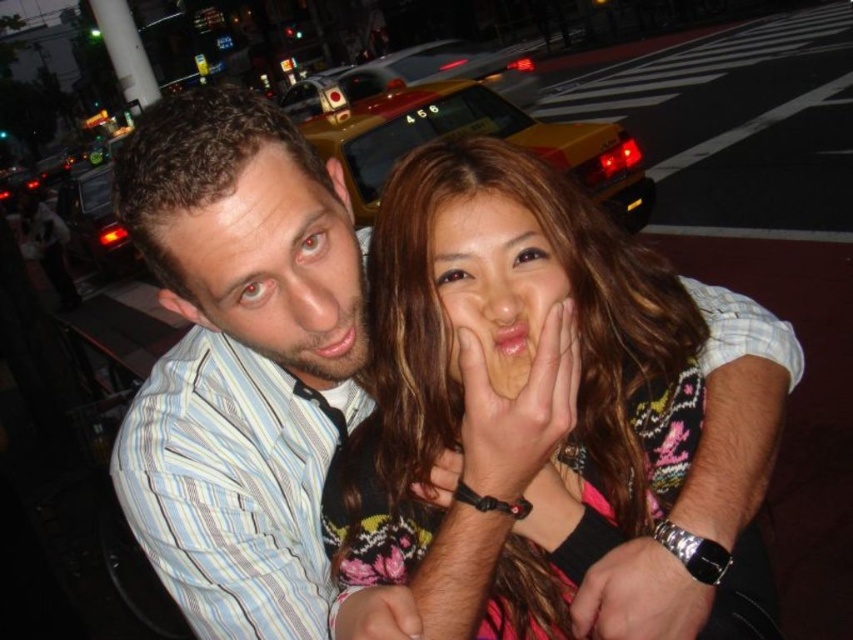
You are a photographer adjusting the focus on your camera. You notice two main subjects in the frame, the striped shirt at center and the colorful top with a mix of pink, black, and yellow patterns. Which subject is exactly at the point you marked as coordinates (x=239, y=360)?

The striped shirt at center is exactly at the point you marked as coordinates (x=239, y=360).

You are a photographer trying to capture the scene with a camera. You want to ensure that both the yellow plastic taxi at upper center and the matte skin face at center are in focus. Based on their positions, which object is closer to the camera?

The matte skin face at center is closer to the camera than the yellow plastic taxi at upper center because the yellow plastic taxi at upper center is positioned above it, indicating it is further away in the background.

You are a photographer trying to focus on the matte skin face at center and the matte striped shirt at center in the image. Which object should you adjust your focus to first if you want to ensure both are in focus, considering their positions?

The matte skin face at center is behind the matte striped shirt at center, so you should focus on the matte striped shirt at center first to ensure both are in focus.